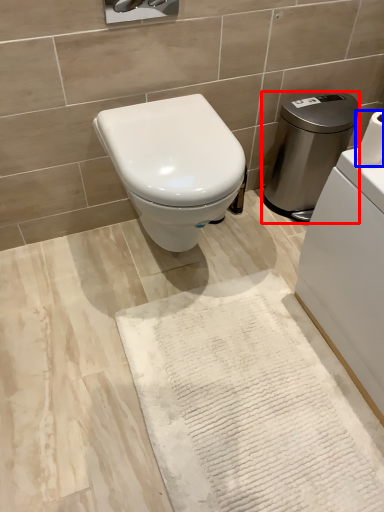
Question: Which point is further to the camera, water heater (highlighted by a red box) or toilet paper (highlighted by a blue box)?

Choices:
 (A) water heater
 (B) toilet paper

Answer: (A)